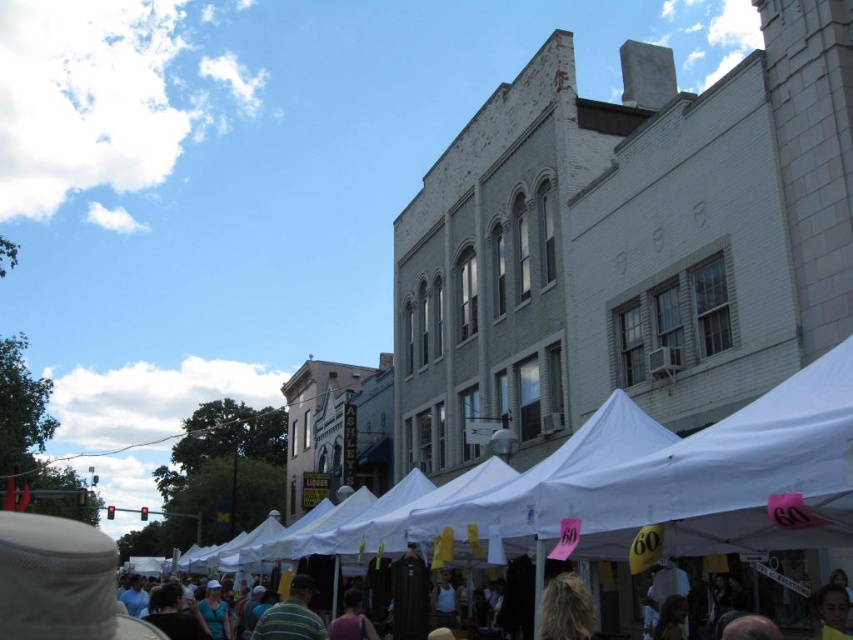
You are a visitor at the market and want to reach the white fabric tent at center to check out the sale. However, there is a dark gray fabric crowd at center blocking your path. Based on the scene description, can you determine which direction you should move to get to the tent without going through the crowd?

The white fabric tent at center is positioned on the left side of dark gray fabric crowd at center. To reach the tent without going through the crowd, you should move to the left side of the dark gray fabric crowd at center.

You are a vendor at the market and want to hang a new sign above the striped fabric at center so it can be seen from the dark gray fabric crowd at center. Will the sign be visible to the crowd?

The striped fabric at center is not as tall as dark gray fabric crowd at center, so the sign hung above the striped fabric at center will be visible to the dark gray fabric crowd at center because the crowd is taller than the fabric.